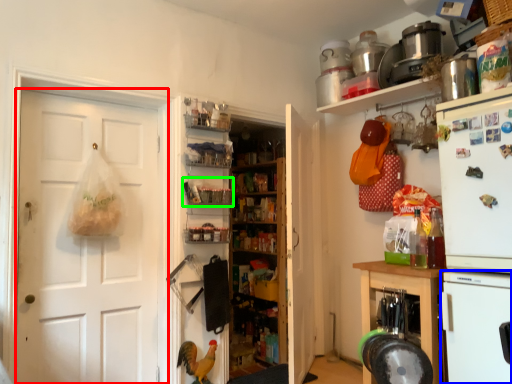
Question: Which object is positioned closest to door (highlighted by a red box)? Select from appliance (highlighted by a blue box) and shelf (highlighted by a green box).

Choices:
 (A) appliance
 (B) shelf

Answer: (B)